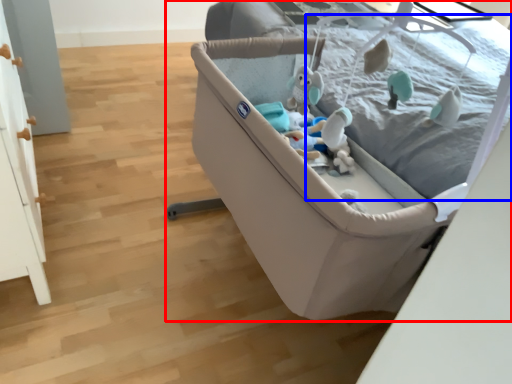
Question: Which point is further to the camera, infant bed (highlighted by a red box) or mattress (highlighted by a blue box)?

Choices:
 (A) infant bed
 (B) mattress

Answer: (A)